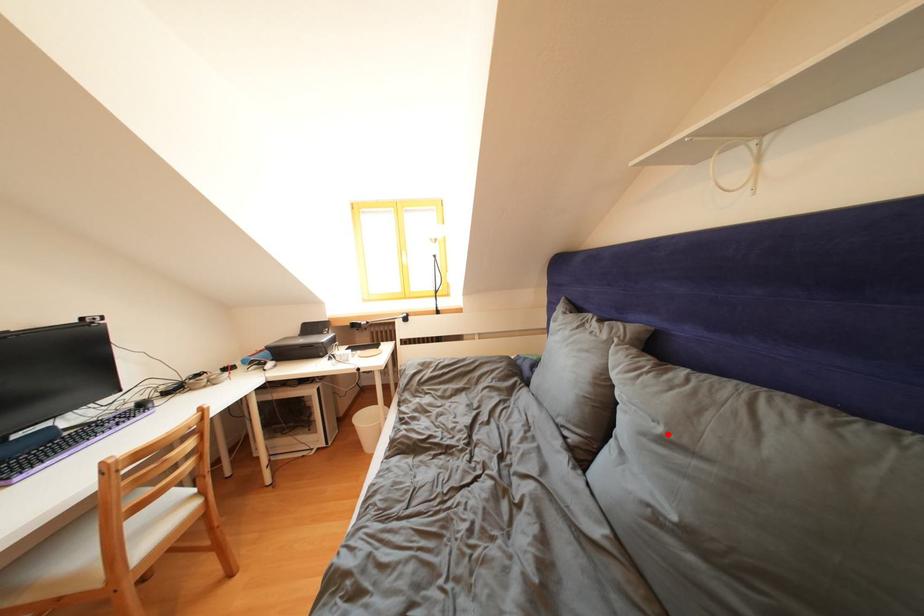
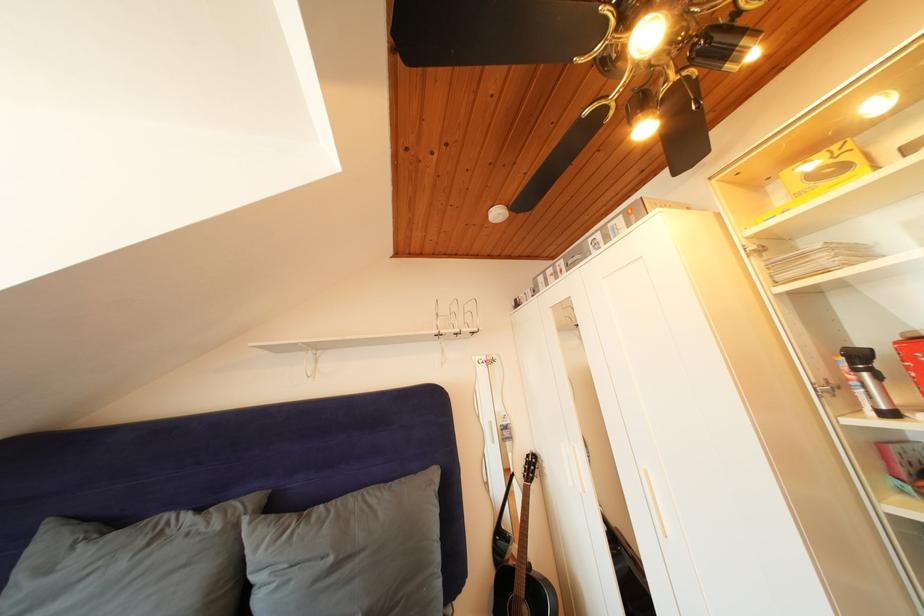
Question: I am providing you with two images of the same scene from different viewpoints. A red point is marked on the first image. At the location where the point appears in image 1, is it still visible in image 2?

Choices:
 (A) Yes
 (B) No

Answer: (A)